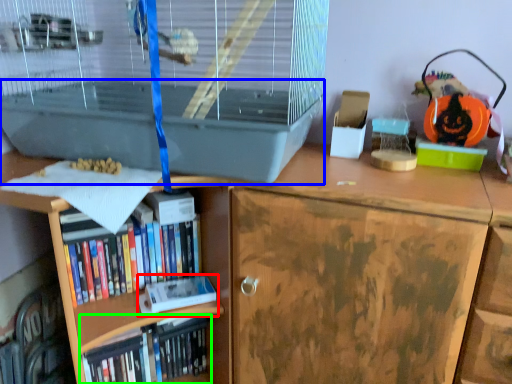
Question: Estimate the real-world distances between objects in this image. Which object is closer to paperback book (highlighted by a red box), wide (highlighted by a blue box) or book (highlighted by a green box)?

Choices:
 (A) wide
 (B) book

Answer: (B)